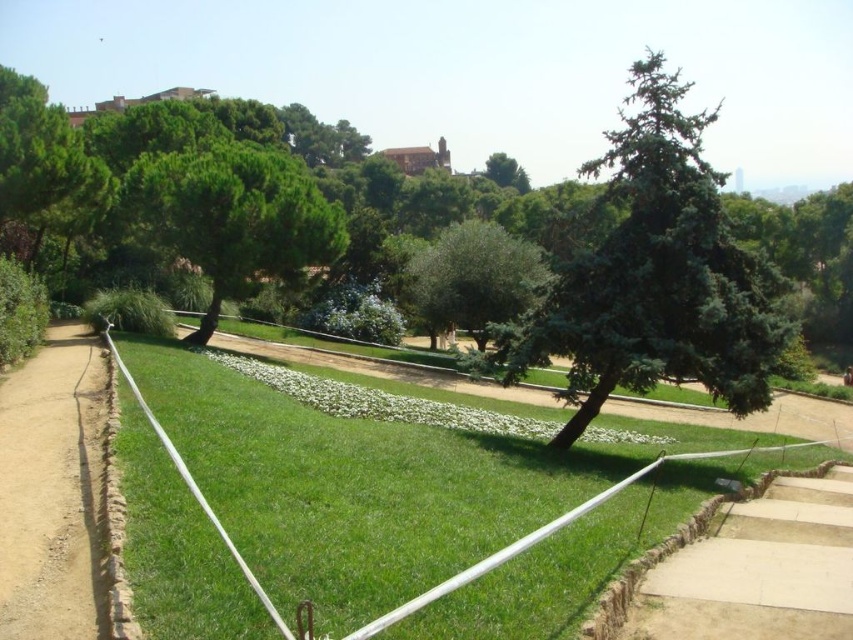
Question: Can you confirm if blue-green needle-like at center-right is thinner than green textured tree at center?

Choices:
 (A) yes
 (B) no

Answer: (B)

Question: Estimate the real-world distances between objects in this image. Which object is farther from the green grassy at center?

Choices:
 (A) green textured tree at center
 (B) green leafy tree at center

Answer: (B)

Question: Which of the following is the farthest from the observer?

Choices:
 (A) dirt/gravel path at left
 (B) blue-green needle-like at center-right

Answer: (B)

Question: In this image, where is blue-green needle-like at center-right located relative to green textured tree at center?

Choices:
 (A) above
 (B) below

Answer: (A)

Question: Considering the relative positions of green leafy tree at center and green grassy at center in the image provided, where is green leafy tree at center located with respect to green grassy at center?

Choices:
 (A) below
 (B) above

Answer: (B)

Question: Among these points, which one is nearest to the camera?

Choices:
 (A) (473, 300)
 (B) (804, 625)

Answer: (B)